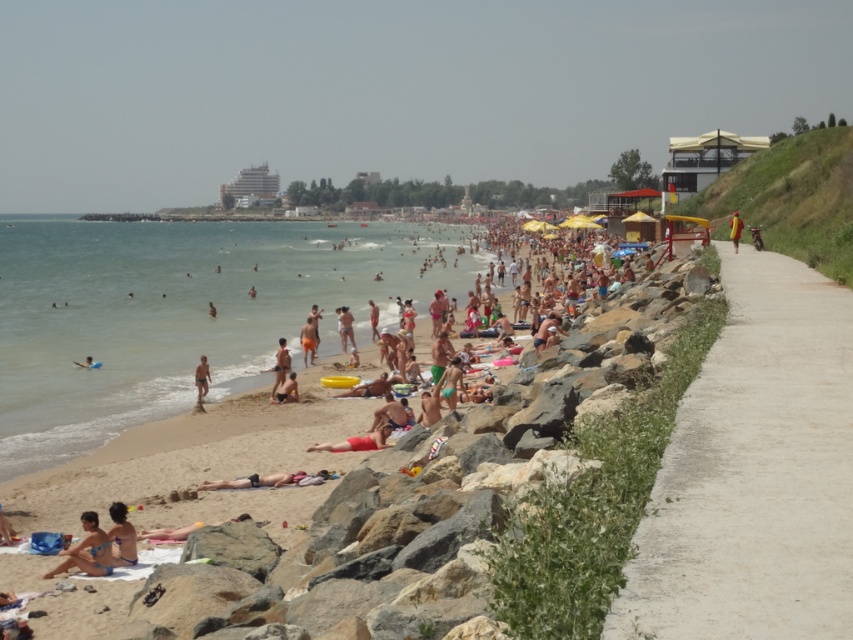
You are standing on the beach and want to walk to the clear blue water at beach left from the tan skin person at beach center. Which direction should you head?

You should head to the left to reach the clear blue water at beach left from the tan skin person at beach center, as it is located to the left of the person.

You are a photographer standing on the beach and want to capture both the red fabric person at center and the tan skin person at beach center in the same frame. Which person should you position lower in your camera viewfinder to include both?

You should position the red fabric person at center lower in your camera viewfinder because it is already below the tan skin person at beach center.

You are a photographer trying to capture a photo of both the red fabric person at center and the tan skin person at beach center. Which person will appear smaller in the photo?

The red fabric person at center will appear smaller in the photo because they are not as tall as the tan skin person at beach center.